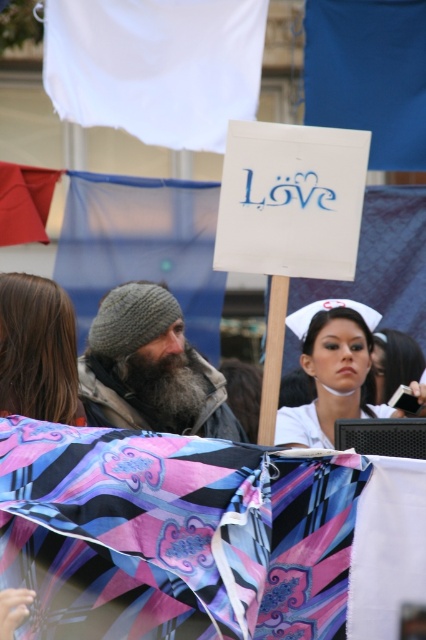
Question: Is gray knitted beanie at center thinner than brown hair at left?

Choices:
 (A) yes
 (B) no

Answer: (B)

Question: Is gray knitted beanie at center positioned in front of brown hair at left?

Choices:
 (A) yes
 (B) no

Answer: (B)

Question: Estimate the real-world distances between objects in this image. Which object is farther from the brown hair at left?

Choices:
 (A) gray knitted beanie at center
 (B) white matte nurse cap at center

Answer: (B)

Question: Considering the real-world distances, which object is closest to the brown hair at left?

Choices:
 (A) gray knitted beanie at center
 (B) white matte nurse cap at center

Answer: (A)

Question: Is gray knitted beanie at center to the left of white matte nurse cap at center from the viewer's perspective?

Choices:
 (A) yes
 (B) no

Answer: (A)

Question: Among these points, which one is nearest to the camera?

Choices:
 (A) (138, 300)
 (B) (43, 324)
 (C) (319, 374)

Answer: (B)